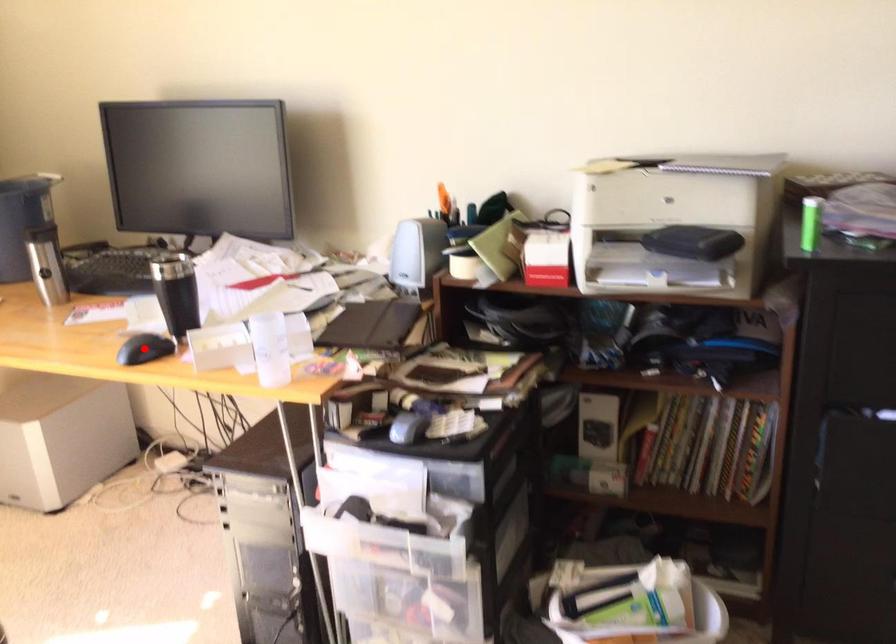
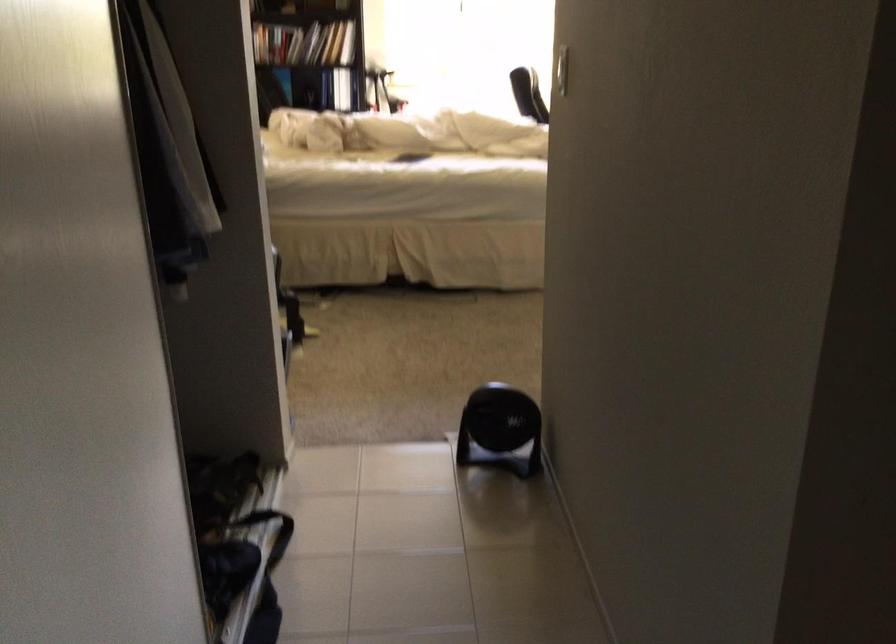
Question: I am providing you with two images of the same scene from different viewpoints. A red point is marked on the first image. Can you still see the location of the red point in image 2?

Choices:
 (A) Yes
 (B) No

Answer: (B)